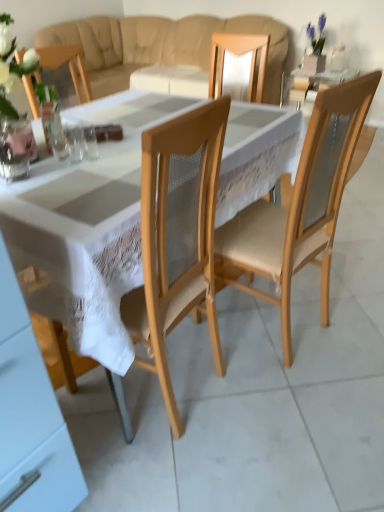
At what (x,y) coordinates should I click in order to perform the action: click on free location to the left of clear glass cup at center, the third tableware positioned from the left. Please return your answer as a coordinate pair (x, y). The height and width of the screenshot is (512, 384). Looking at the image, I should click on (39, 158).